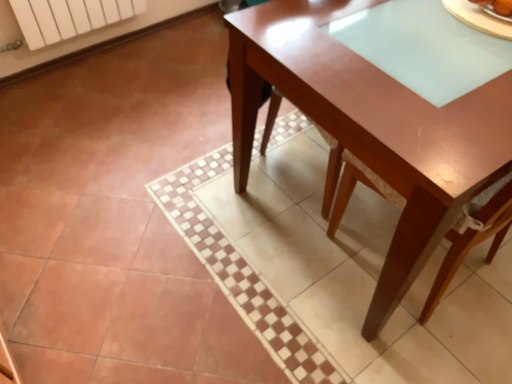
You are a GUI agent. You are given a task and a screenshot of the screen. Output one action in this format:
    pyautogui.click(x=<x>, y=<y>)
    Task: Click on the vacant area situated below white matte radiator at upper left (from a real-world perspective)
    
    Given the screenshot: What is the action you would take?
    [x=85, y=60]